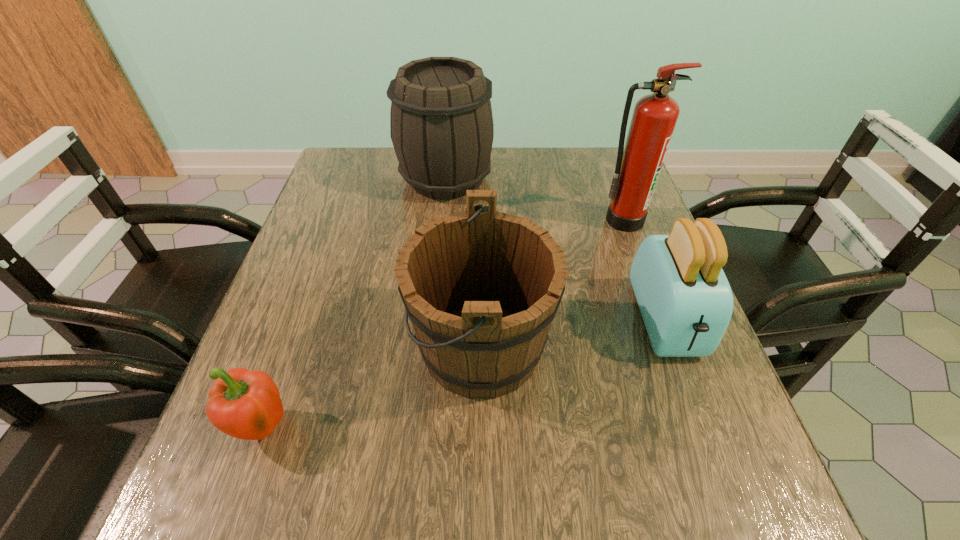
Where is `the second farthest object`? This screenshot has width=960, height=540. the second farthest object is located at coordinates (639, 163).

Identify the location of fire extinguisher. (639, 163).

Find the location of a particular element. the farther wine bucket is located at coordinates pos(441,125).

I want to click on the nearer wine bucket, so click(x=481, y=287).

The image size is (960, 540). I want to click on toaster, so click(686, 302).

This screenshot has width=960, height=540. I want to click on the shortest object, so click(x=244, y=404).

Image resolution: width=960 pixels, height=540 pixels. I want to click on the leftmost object, so click(244, 404).

Locate an element on the screen. This screenshot has height=540, width=960. free location located with the nozzle pointing from the back of the fourth nearest object is located at coordinates (638, 261).

Locate an element on the screen. free location located on the left of the farthest object is located at coordinates (352, 178).

Find the location of `vacant position located 0.150m on the side of the nearer wine bucket with the handle for carrying`. vacant position located 0.150m on the side of the nearer wine bucket with the handle for carrying is located at coordinates click(332, 347).